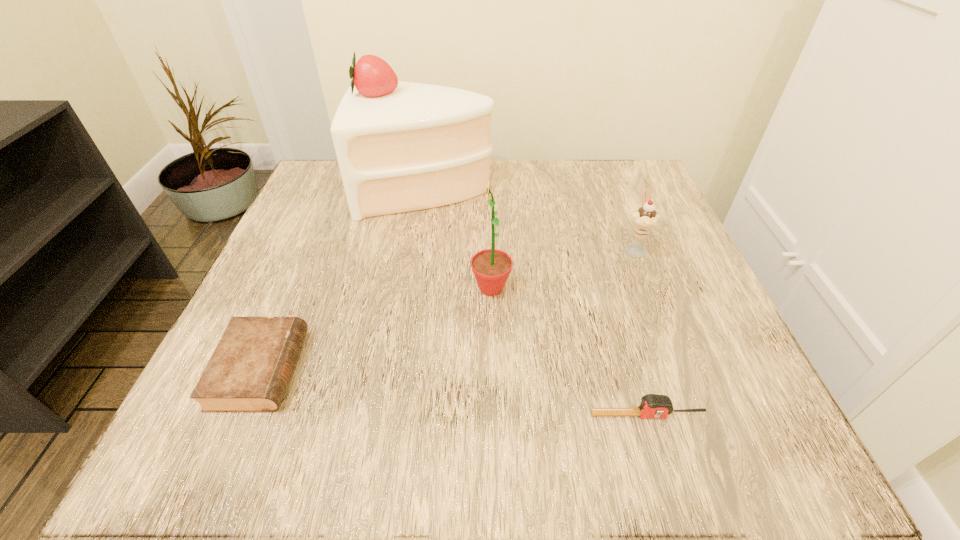
Where is `vacant area that lies between the third nearest object and the third shortest object`? The image size is (960, 540). vacant area that lies between the third nearest object and the third shortest object is located at coordinates (563, 268).

The width and height of the screenshot is (960, 540). What are the coordinates of `free spot between the sunflower and the cake` in the screenshot? It's located at (459, 239).

The image size is (960, 540). In order to click on free spot between the farthest object and the fourth nearest object in this screenshot , I will do click(531, 219).

Locate an element on the screen. vacant space that is in between the diary and the fourth shortest object is located at coordinates (375, 329).

Identify the location of free spot between the icecream and the tape measure. This screenshot has height=540, width=960. (641, 332).

Find the location of a particular element. The width and height of the screenshot is (960, 540). free area in between the third shortest object and the tallest object is located at coordinates (531, 219).

Where is `free space between the third shortest object and the farthest object`? The image size is (960, 540). free space between the third shortest object and the farthest object is located at coordinates (531, 219).

The width and height of the screenshot is (960, 540). Find the location of `free area in between the tape measure and the third shortest object`. free area in between the tape measure and the third shortest object is located at coordinates (641, 332).

The image size is (960, 540). Identify the location of free space between the tape measure and the sunflower. (569, 352).

Locate an element on the screen. The width and height of the screenshot is (960, 540). free point between the cake and the diary is located at coordinates (344, 279).